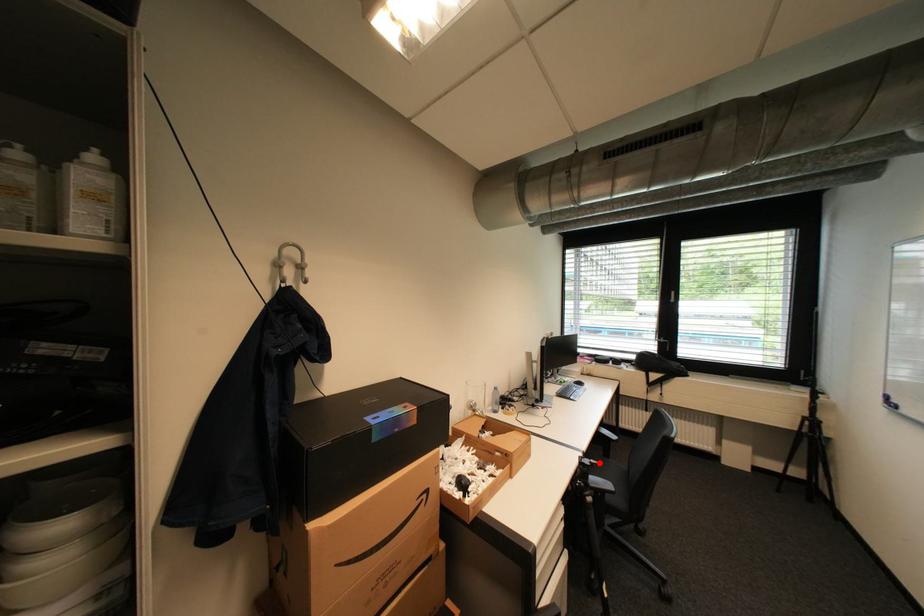
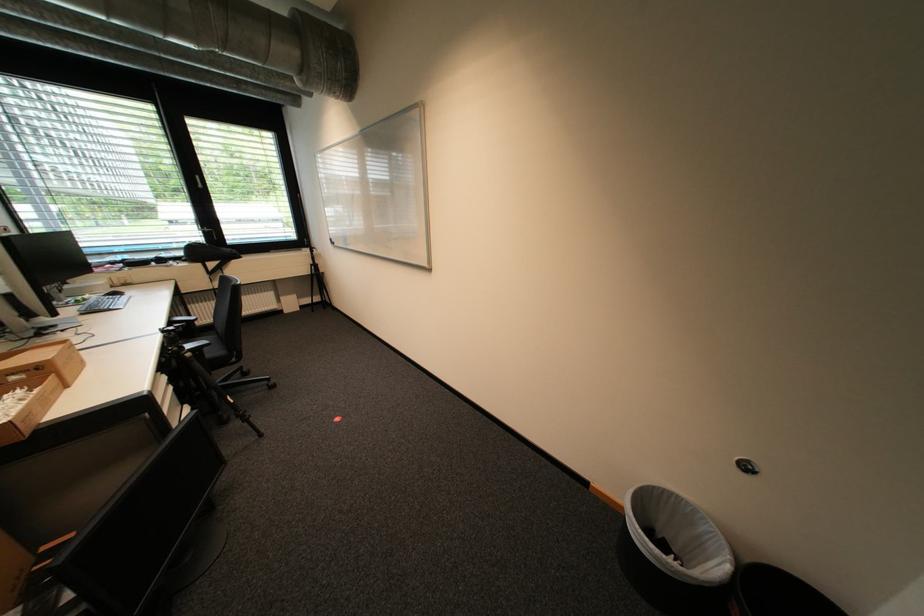
In the second image, find the point that corresponds to the highlighted location in the first image.

(184, 328)